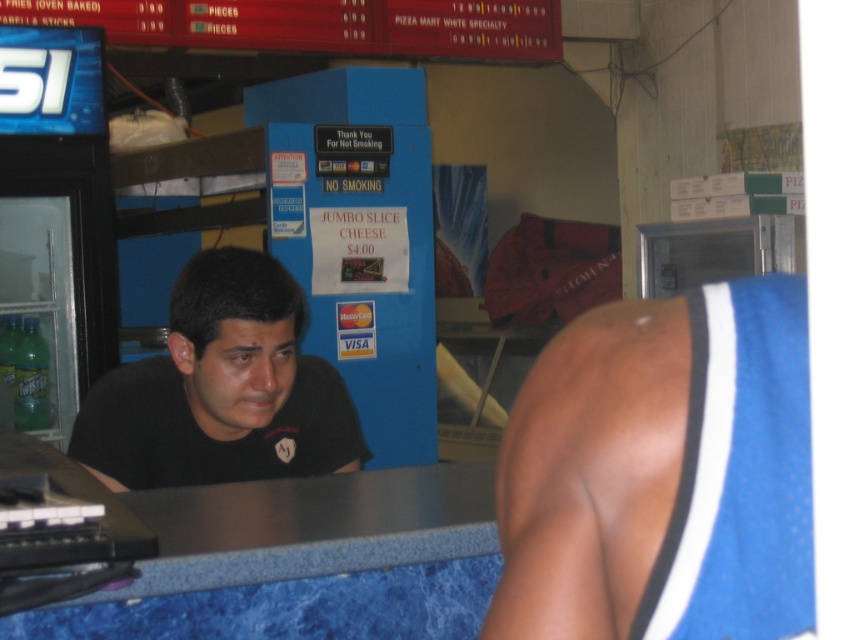
Question: Can you confirm if blue jersey at center is positioned below black matte shirt at center?

Choices:
 (A) yes
 (B) no

Answer: (B)

Question: Which object is positioned closest to the black matte shirt at center?

Choices:
 (A) blue jersey at center
 (B) blue laminate counter at center

Answer: (B)

Question: Which of the following is the closest to the observer?

Choices:
 (A) (228, 333)
 (B) (466, 634)
 (C) (595, 380)

Answer: (C)

Question: Which point is farther to the camera?

Choices:
 (A) blue laminate counter at center
 (B) blue jersey at center

Answer: (A)

Question: Does blue laminate counter at center have a larger size compared to black matte shirt at center?

Choices:
 (A) yes
 (B) no

Answer: (B)

Question: Can you confirm if blue jersey at center is positioned to the left of blue laminate counter at center?

Choices:
 (A) yes
 (B) no

Answer: (B)